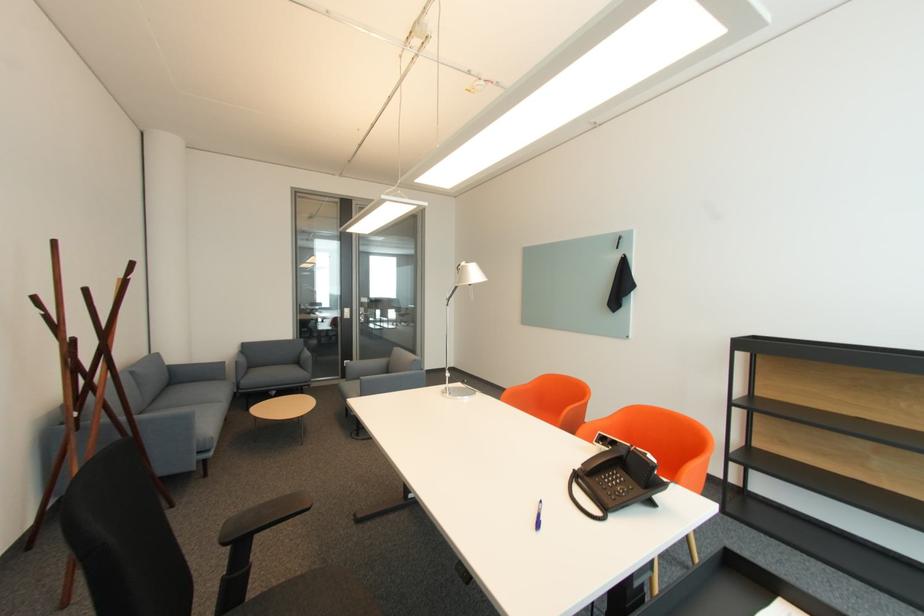
Describe the element at coordinates (367, 315) in the screenshot. Image resolution: width=924 pixels, height=616 pixels. I see `the vertical door handle` at that location.